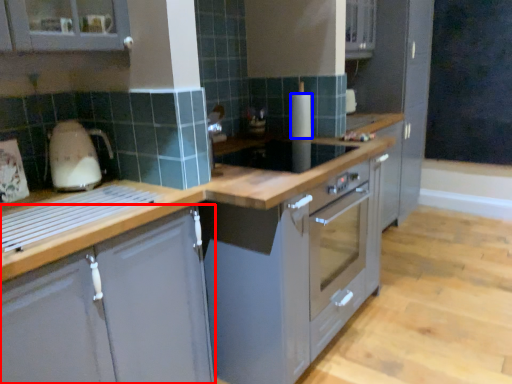
Question: Which of the following is the closest to the observer, cabinetry (highlighted by a red box) or kitchen appliance (highlighted by a blue box)?

Choices:
 (A) cabinetry
 (B) kitchen appliance

Answer: (A)